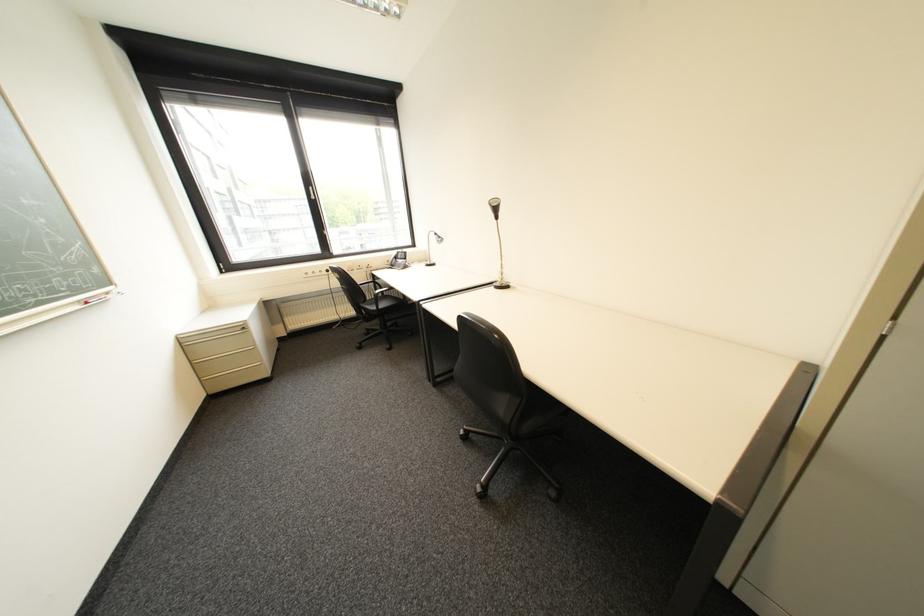
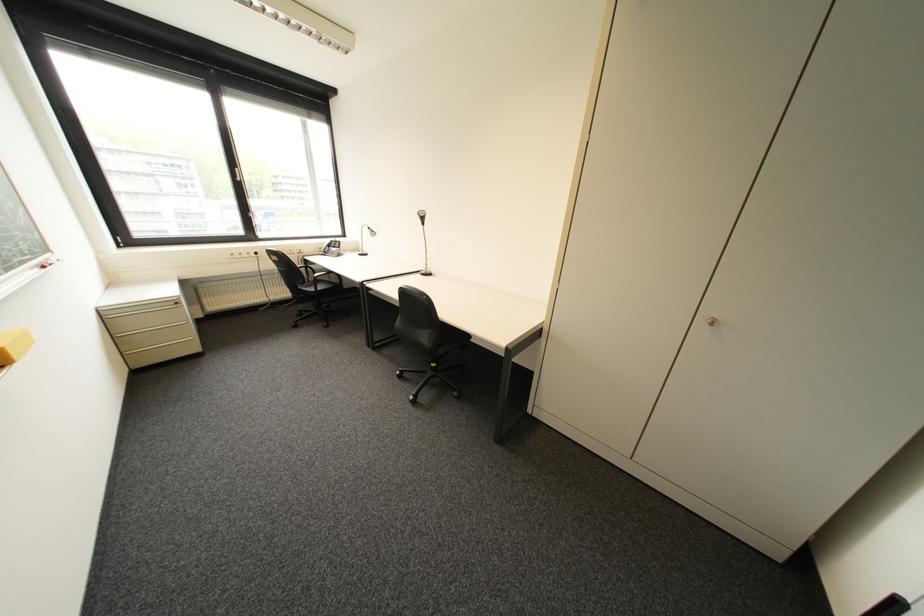
The point at (323,198) is marked in the first image. Where is the corresponding point in the second image?

(249, 180)